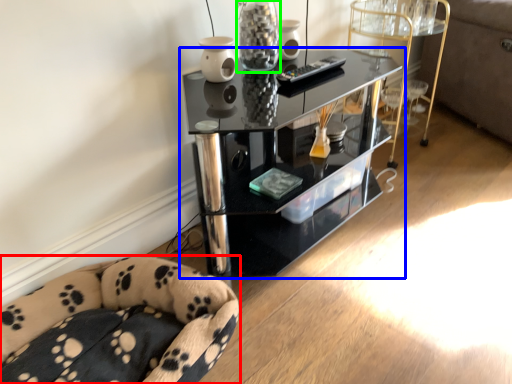
Question: Considering the real-world distances, which object is farthest from furniture (highlighted by a red box)? shelf (highlighted by a blue box) or glass vase (highlighted by a green box)?

Choices:
 (A) shelf
 (B) glass vase

Answer: (B)